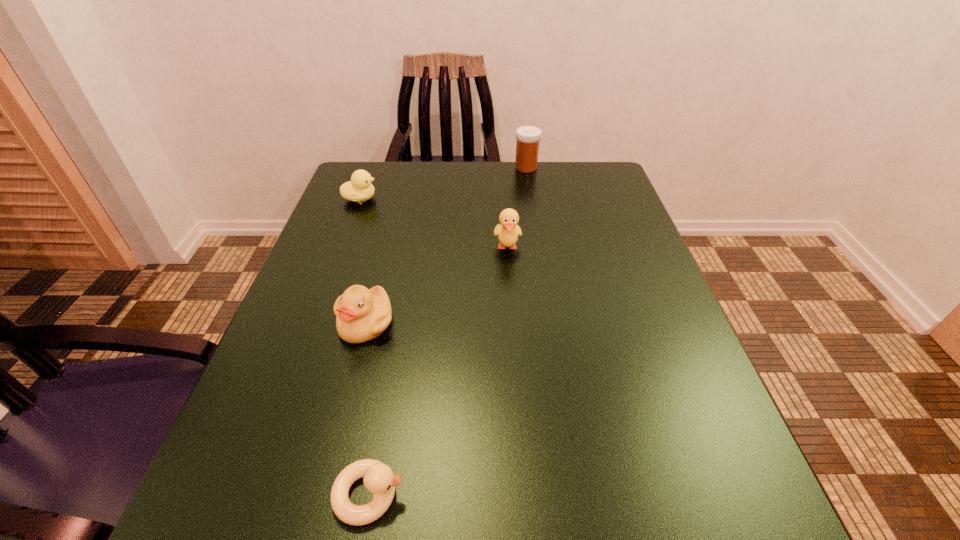
This screenshot has height=540, width=960. Find the location of `vacant space at the right edge of the desktop`. vacant space at the right edge of the desktop is located at coordinates (644, 491).

Where is `vacant space at the far left corner`? This screenshot has height=540, width=960. vacant space at the far left corner is located at coordinates (390, 207).

Find the location of a particular element. The image size is (960, 540). free space at the near left corner is located at coordinates pyautogui.click(x=301, y=535).

Identify the location of vacant region at the far right corner. This screenshot has width=960, height=540. (581, 189).

Locate an element on the screen. unoccupied area between the farthest duckling and the second nearest duckling is located at coordinates coord(363,260).

Where is `free point between the fourth farthest object and the medicine`? free point between the fourth farthest object and the medicine is located at coordinates (445, 245).

In order to click on free space between the farthest object and the second shortest duckling in this screenshot , I will do `click(443, 183)`.

Locate an element on the screen. free spot between the farthest object and the second farthest object is located at coordinates (443, 183).

Locate an element on the screen. free space between the third farthest object and the fourth farthest object is located at coordinates pos(437,285).

At what (x,y) coordinates should I click in order to perform the action: click on vacant space that is in between the medicine and the nearest duckling. Please return your answer as a coordinate pair (x, y). The width and height of the screenshot is (960, 540). Looking at the image, I should click on (447, 331).